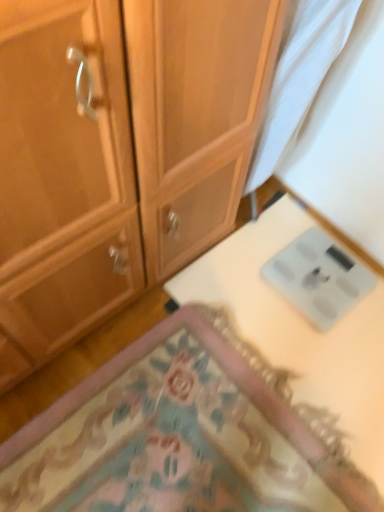
Question: From a real-world perspective, is white glossy scale at lower right physically above carpeted mat at lower center?

Choices:
 (A) no
 (B) yes

Answer: (A)

Question: Is white glossy scale at lower right completely or partially outside of carpeted mat at lower center?

Choices:
 (A) yes
 (B) no

Answer: (B)

Question: Are white glossy scale at lower right and carpeted mat at lower center making contact?

Choices:
 (A) yes
 (B) no

Answer: (B)

Question: Is white glossy scale at lower right closer to the viewer compared to carpeted mat at lower center?

Choices:
 (A) no
 (B) yes

Answer: (A)

Question: Would you say white glossy scale at lower right contains carpeted mat at lower center?

Choices:
 (A) yes
 (B) no

Answer: (B)

Question: In the image, is white glossy scale at lower right on the left side or the right side of carpeted mat at lower center?

Choices:
 (A) left
 (B) right

Answer: (B)

Question: From the image's perspective, is white glossy scale at lower right located above or below carpeted mat at lower center?

Choices:
 (A) above
 (B) below

Answer: (A)

Question: From a real-world perspective, is white glossy scale at lower right positioned above or below carpeted mat at lower center?

Choices:
 (A) below
 (B) above

Answer: (A)

Question: Is white glossy scale at lower right bigger or smaller than carpeted mat at lower center?

Choices:
 (A) big
 (B) small

Answer: (B)

Question: Choose the correct answer: Is white sheer curtain at upper right inside carpeted mat at lower center or outside it?

Choices:
 (A) outside
 (B) inside

Answer: (A)

Question: Considering their positions, is white sheer curtain at upper right located in front of or behind carpeted mat at lower center?

Choices:
 (A) front
 (B) behind

Answer: (A)

Question: In terms of height, does white sheer curtain at upper right look taller or shorter compared to carpeted mat at lower center?

Choices:
 (A) short
 (B) tall

Answer: (B)

Question: Based on their sizes in the image, would you say white sheer curtain at upper right is bigger or smaller than carpeted mat at lower center?

Choices:
 (A) big
 (B) small

Answer: (B)

Question: Is carpeted mat at lower center bigger or smaller than white sheer curtain at upper right?

Choices:
 (A) small
 (B) big

Answer: (B)

Question: Is carpeted mat at lower center inside or outside of white sheer curtain at upper right?

Choices:
 (A) outside
 (B) inside

Answer: (A)